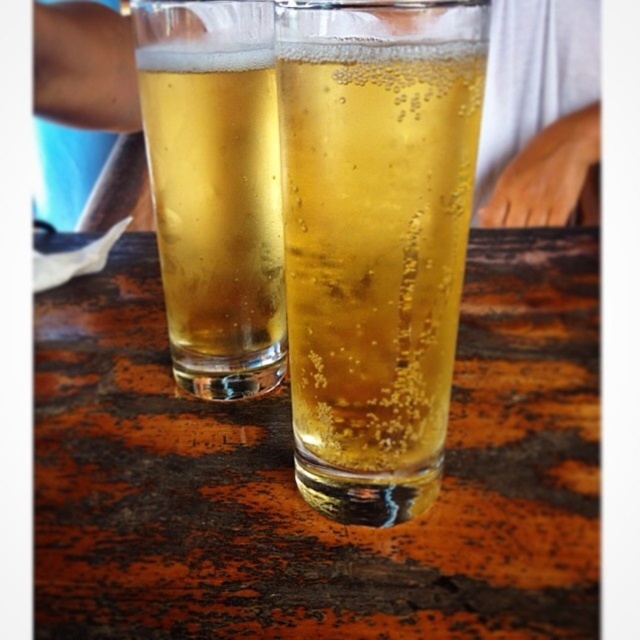
You are at the point marked as point (474, 561) and want to reach the point marked as point (378, 461). Given the scene description, can you walk directly towards it without any obstacles?

Point (474, 561) is in front of point (378, 461), so you cannot walk directly towards it because the point you are at is already in front of your destination.

You are at a bar and want to place a coaster under your translucent glass at left. The coaster is 10 cm in diameter. Is the wooden table at center large enough to accommodate the coaster without it hanging off the edge?

The wooden table at center has a larger size compared to the translucent glass at left. Since the coaster is 10 cm in diameter, and the table is larger than the glass, it should have enough space to place the coaster without it hanging off the edge.